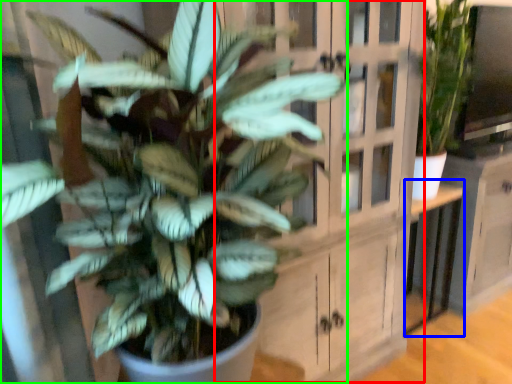
Question: Which is farther away from dresser (highlighted by a red box)? table (highlighted by a blue box) or houseplant (highlighted by a green box)?

Choices:
 (A) table
 (B) houseplant

Answer: (A)